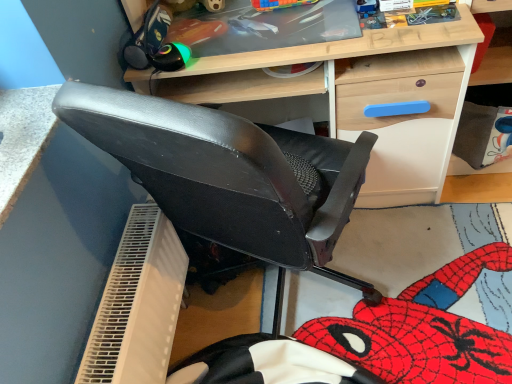
Question: Should I look upward or downward to see white textured table at upper left?

Choices:
 (A) up
 (B) down

Answer: (A)

Question: Could light wood desk at center be considered to be inside white textured table at upper left?

Choices:
 (A) no
 (B) yes

Answer: (A)

Question: Is white textured table at upper left bigger than light wood desk at center?

Choices:
 (A) no
 (B) yes

Answer: (A)

Question: Can you confirm if white textured table at upper left is positioned to the right of light wood desk at center?

Choices:
 (A) yes
 (B) no

Answer: (B)

Question: Is white textured table at upper left not close to light wood desk at center?

Choices:
 (A) no
 (B) yes

Answer: (A)

Question: Is white textured table at upper left positioned beyond the bounds of light wood desk at center?

Choices:
 (A) yes
 (B) no

Answer: (A)

Question: Does white textured table at upper left have a greater height compared to light wood desk at center?

Choices:
 (A) no
 (B) yes

Answer: (A)

Question: Is light wood desk at center to the right of white textured table at upper left from the viewer's perspective?

Choices:
 (A) no
 (B) yes

Answer: (B)

Question: Can you confirm if light wood desk at center is thinner than white textured table at upper left?

Choices:
 (A) no
 (B) yes

Answer: (A)

Question: From a real-world perspective, is light wood desk at center located higher than white textured table at upper left?

Choices:
 (A) no
 (B) yes

Answer: (A)

Question: Can you confirm if light wood desk at center is shorter than white textured table at upper left?

Choices:
 (A) no
 (B) yes

Answer: (A)

Question: Are light wood desk at center and white textured table at upper left far apart?

Choices:
 (A) yes
 (B) no

Answer: (B)

Question: From the image's perspective, is light wood desk at center located above white textured table at upper left?

Choices:
 (A) yes
 (B) no

Answer: (A)

Question: Considering their positions, is light wood desk at center located in front of or behind white textured table at upper left?

Choices:
 (A) front
 (B) behind

Answer: (B)